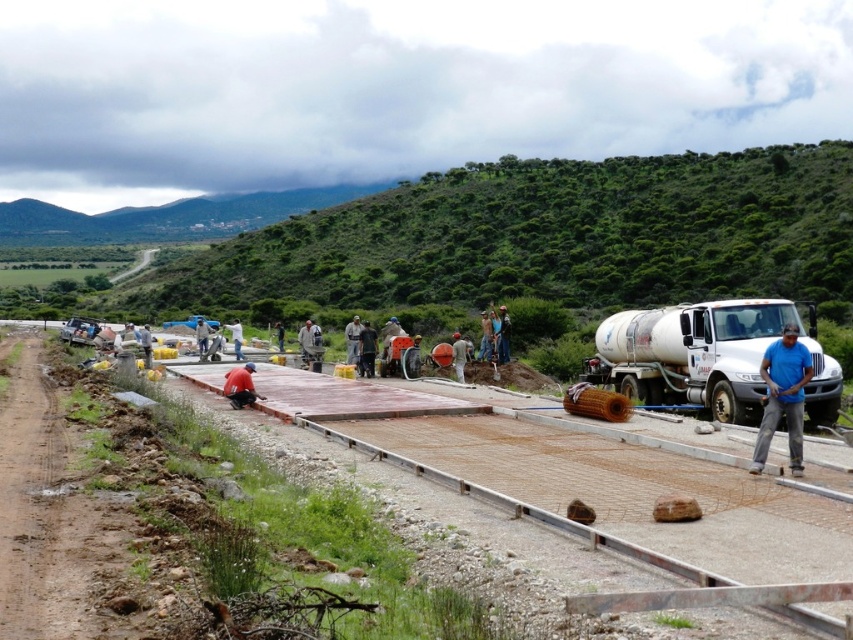
Looking at this image, you are a construction worker who needs to pour concrete from the white metallic tanker truck at right into the smooth concrete slab at center. Based on the scene, can you safely maneuver the truck to the slab?

The smooth concrete slab at center is to the left of the white metallic tanker truck at right, so you can safely maneuver the truck to the left to pour the concrete into the slab.

You are a safety inspector at the construction site. You notice two workers wearing blue clothing at the center of the site. One is labeled as the blue fabric construction worker at center and the other as the blue shirt at center. According to the safety protocol, workers must maintain a minimum distance of 1 meter between each other. Can you determine if they are complying with this rule?

The blue fabric construction worker at center is to the right of the blue shirt at center, but the exact distance between them isn not specified. Therefore, it is impossible to determine if they are complying with the 1 meter rule based on the provided information.